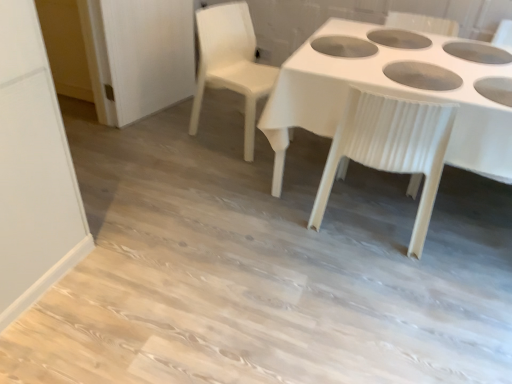
Identify the location of vacant area that is in front of white plastic chair at center, arranged as the 1th chair when viewed from the right. The image size is (512, 384). (379, 281).